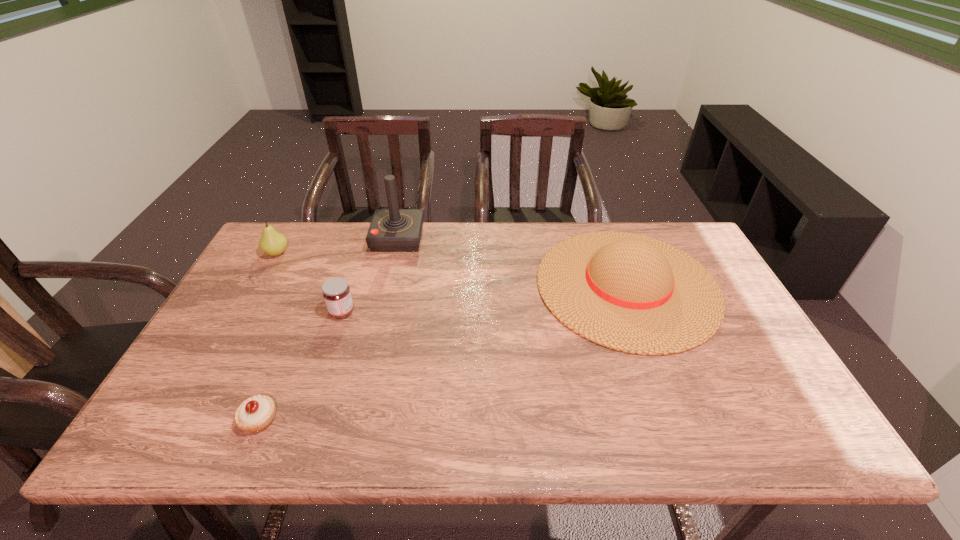
Find the location of a particular element. empty space that is in between the jam and the third tallest object is located at coordinates (309, 282).

You are a GUI agent. You are given a task and a screenshot of the screen. Output one action in this format:
    pyautogui.click(x=<x>, y=<y>)
    Task: Click on the free area in between the third tallest object and the jam
    
    Given the screenshot: What is the action you would take?
    pyautogui.click(x=309, y=282)

Find the location of a particular element. This screenshot has width=960, height=540. empty location between the nearest object and the leftmost object is located at coordinates (268, 336).

This screenshot has width=960, height=540. I want to click on unoccupied area between the nearest object and the third tallest object, so click(x=268, y=336).

Identify the location of unoccupied position between the pastry and the jam. This screenshot has height=540, width=960. (300, 366).

In order to click on unoccupied position between the rightmost object and the fourth object from right to left in this screenshot , I will do `click(444, 352)`.

Choose which object is the nearest neighbor to the pear. Please provide its 2D coordinates. Your answer should be formatted as a tuple, i.e. [(x, y)], where the tuple contains the x and y coordinates of a point satisfying the conditions above.

[(391, 230)]

Image resolution: width=960 pixels, height=540 pixels. Identify the location of object that is the second nearest to the tallest object. (273, 243).

The height and width of the screenshot is (540, 960). Find the location of `vacant point that satisfies the following two spatial constraints: 1. on the rectangular base of the bonnet; 2. on the left side of the tallest object`. vacant point that satisfies the following two spatial constraints: 1. on the rectangular base of the bonnet; 2. on the left side of the tallest object is located at coordinates (387, 286).

Identify the location of vacant space that satisfies the following two spatial constraints: 1. on the back side of the rightmost object; 2. on the rectangular base of the joystick. (610, 238).